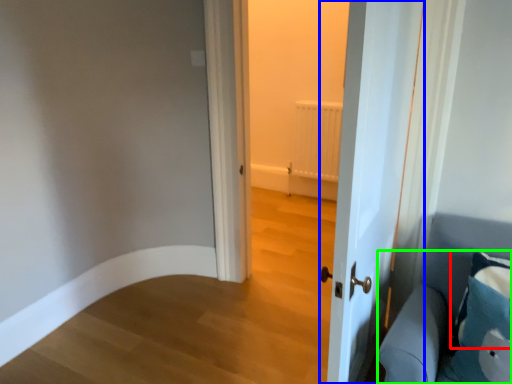
Question: Which is farther away from pillow (highlighted by a red box)? door (highlighted by a blue box) or furniture (highlighted by a green box)?

Choices:
 (A) door
 (B) furniture

Answer: (A)